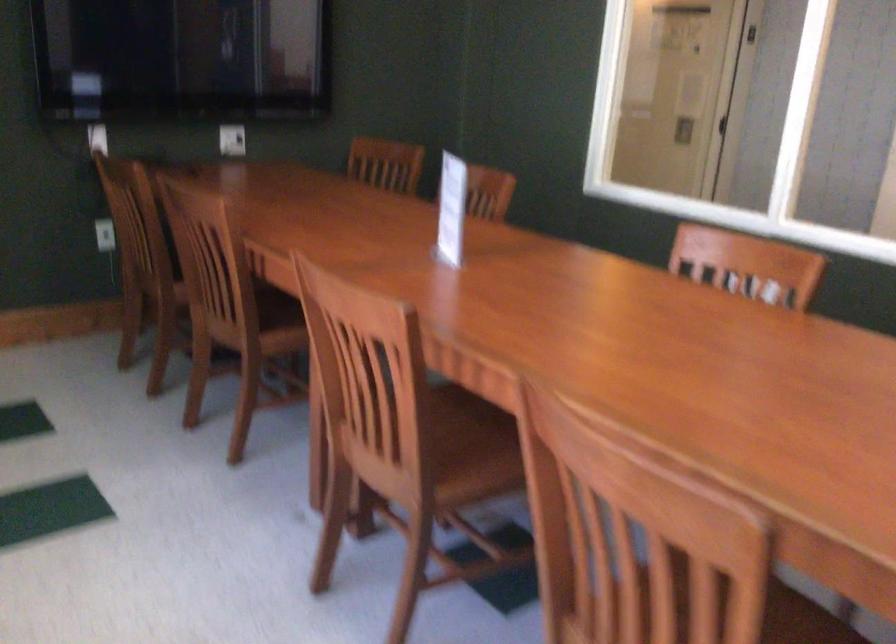
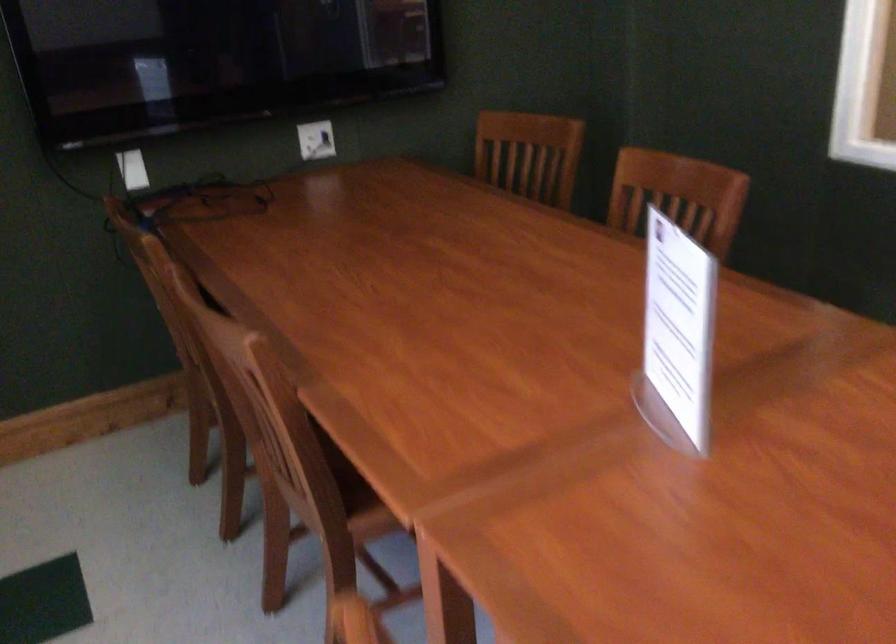
The point at (385, 166) is marked in the first image. Where is the corresponding point in the second image?

(529, 154)